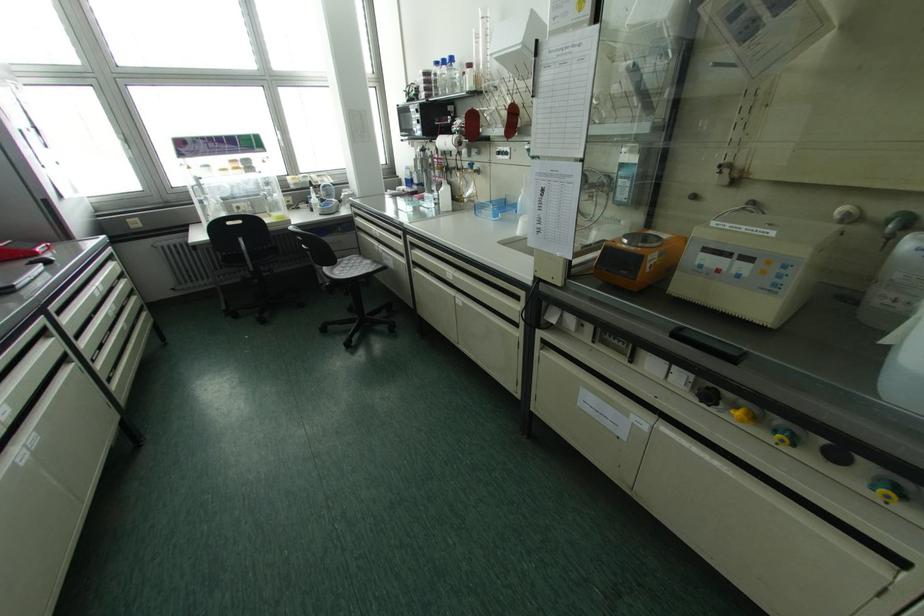
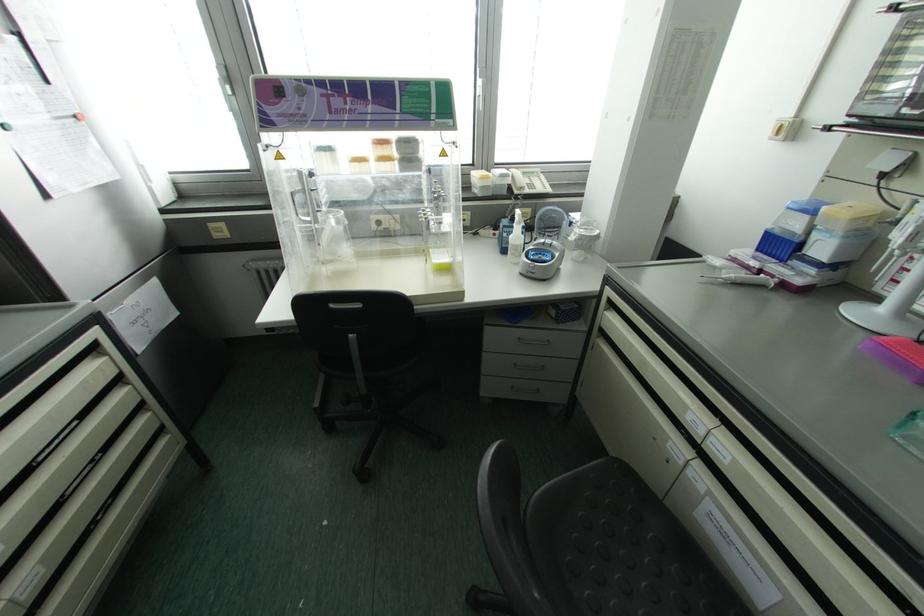
In the second image, find the point that corresponds to (x=408, y=182) in the first image.

(777, 245)